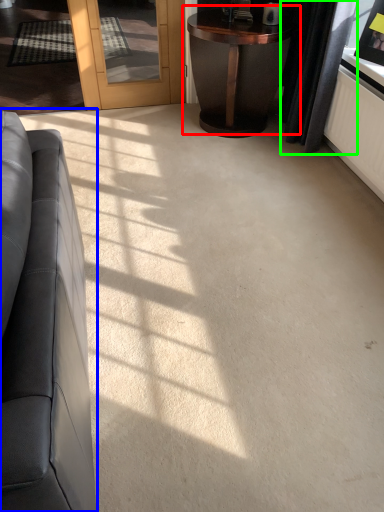
Question: Which object is the closest to the table (highlighted by a red box)? Choose among these: studio couch (highlighted by a blue box) or curtain (highlighted by a green box).

Choices:
 (A) studio couch
 (B) curtain

Answer: (B)